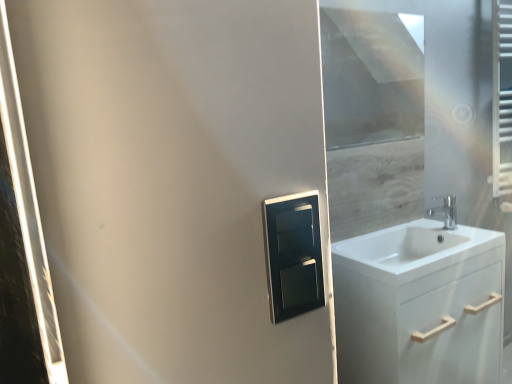
Question: Considering the positions of white glossy sink at right and chrome metallic faucet at right in the image, is white glossy sink at right bigger or smaller than chrome metallic faucet at right?

Choices:
 (A) big
 (B) small

Answer: (A)

Question: In terms of height, does white glossy sink at right look taller or shorter compared to chrome metallic faucet at right?

Choices:
 (A) short
 (B) tall

Answer: (A)

Question: Which of these objects is positioned closest to the chrome metallic faucet at right?

Choices:
 (A) satin black medicine cabinet at center
 (B) white glossy sink at right
 (C) white matte cabinet at right
 (D) transparent glass window screen at upper right

Answer: (B)

Question: Estimate the real-world distances between objects in this image. Which object is farther from the transparent glass window screen at upper right?

Choices:
 (A) chrome metallic faucet at right
 (B) satin black medicine cabinet at center
 (C) white glossy sink at right
 (D) white matte cabinet at right

Answer: (B)